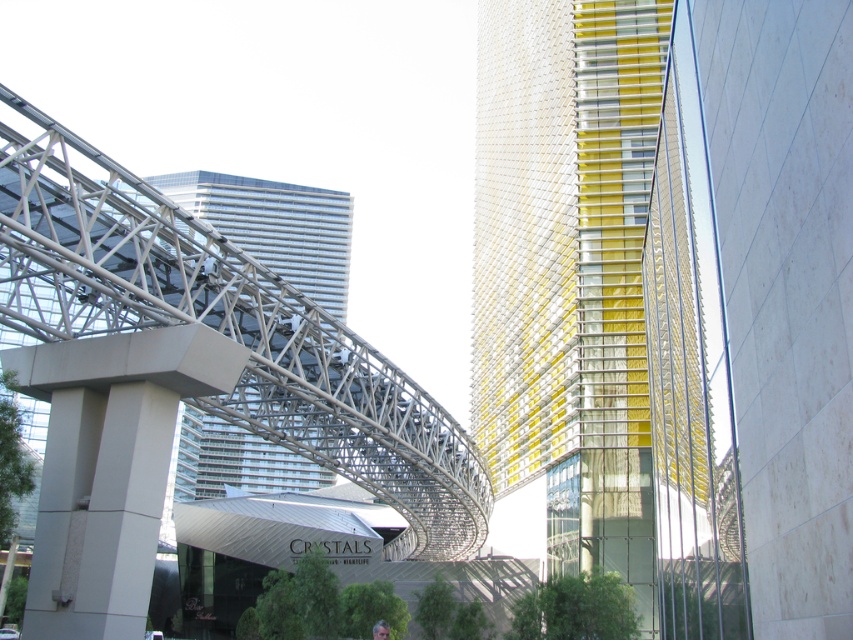
You are an architect evaluating the urban layout. You notice the yellow glass building at center and the glassy reflective skyscraper at center. Which of these two structures has a smaller width?

The yellow glass building at center is thinner than the glassy reflective skyscraper at center, so it has a smaller width.